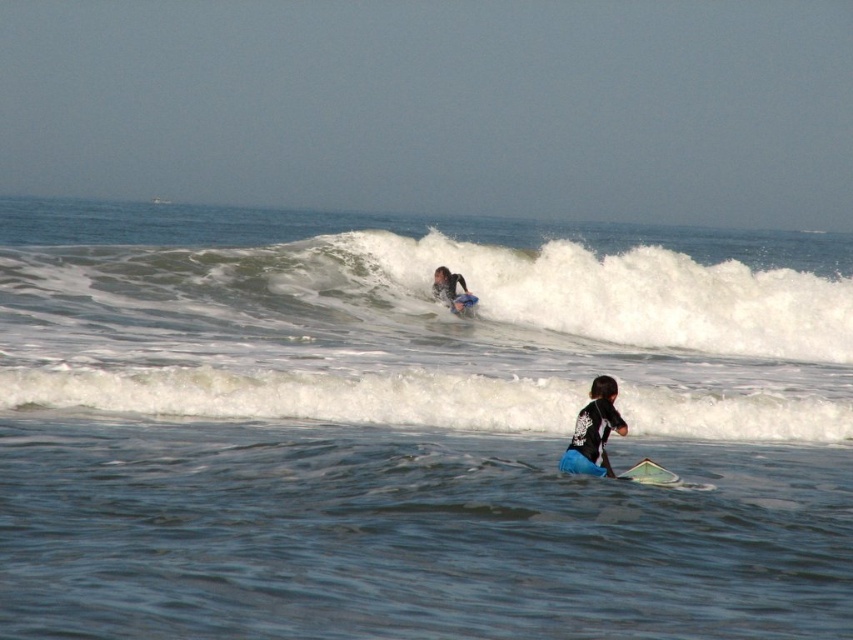
Does point (303, 321) come in front of point (602, 467)?

No, it is not.

Between blue water at wave center and blue rubber paddle at lower center, which one appears on the left side from the viewer's perspective?

From the viewer's perspective, blue rubber paddle at lower center appears more on the left side.

Is point (18, 298) farther from viewer compared to point (602, 458)?

Yes.

Locate an element on the screen. blue water at wave center is located at coordinates (415, 428).

Image resolution: width=853 pixels, height=640 pixels. What do you see at coordinates (415, 428) in the screenshot? I see `blue water at wave center` at bounding box center [415, 428].

Who is lower down, blue water at wave center or white frothy wave at upper center?

white frothy wave at upper center is lower down.

Does point (698, 499) come behind point (682, 320)?

That is False.

Locate an element on the screen. This screenshot has height=640, width=853. blue water at wave center is located at coordinates (415, 428).

Which is in front, point (575, 516) or point (656, 467)?

Positioned in front is point (575, 516).

Is point (647, 369) positioned after point (635, 465)?

Yes, point (647, 369) is behind point (635, 465).

You are a GUI agent. You are given a task and a screenshot of the screen. Output one action in this format:
    pyautogui.click(x=<x>, y=<y>)
    Task: Click on the blue water at wave center
    This screenshot has height=640, width=853.
    Given the screenshot: What is the action you would take?
    pyautogui.click(x=415, y=428)